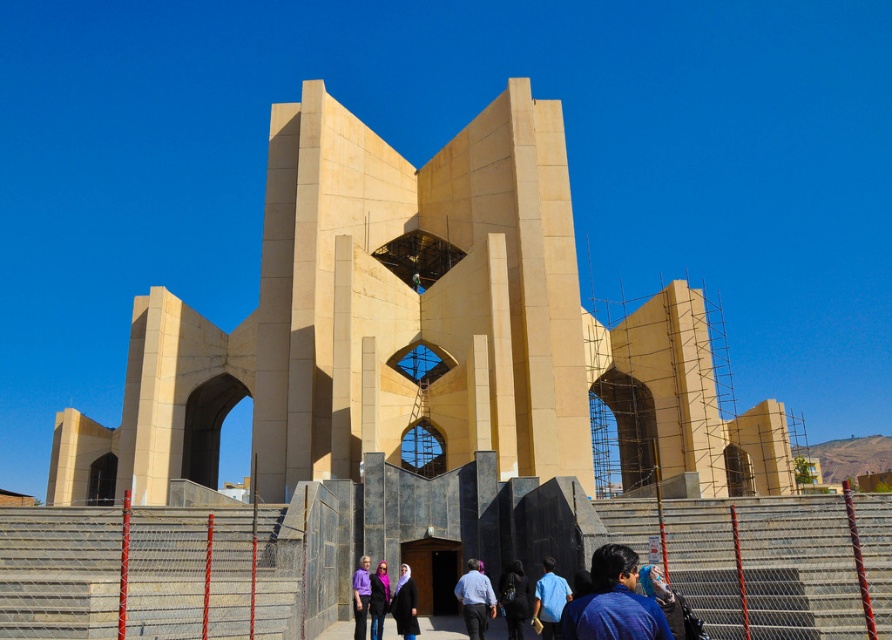
You are a tour guide leading a group near the construction site of a modernist building. You notice two items in the scene, the blue fabric shirt at lower right and the matte purple scarf at center. Your tour group is standing at the base of the building. Which item is closer to the group?

The blue fabric shirt at lower right is closer to the tour group because it is located at the lower right, while the matte purple scarf at center is positioned further away at the center of the scene.

You are a construction worker who needs to move a heavy tool from the gray concrete stairs at lower center to the dark blue fabric at center. Given that the tool weighs 50 pounds and you can carry it for up to 50 feet, will you be able to carry it all the way without needing to rest?

The gray concrete stairs at lower center and dark blue fabric at center are 49.74 feet apart. Since the distance is less than 50 feet, you can carry the tool all the way without needing to rest.